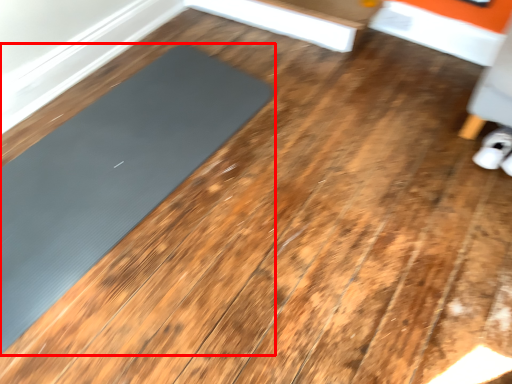
Question: From the image's perspective, where is mat (annotated by the red box) located in relation to footwear in the image?

Choices:
 (A) below
 (B) above

Answer: (A)